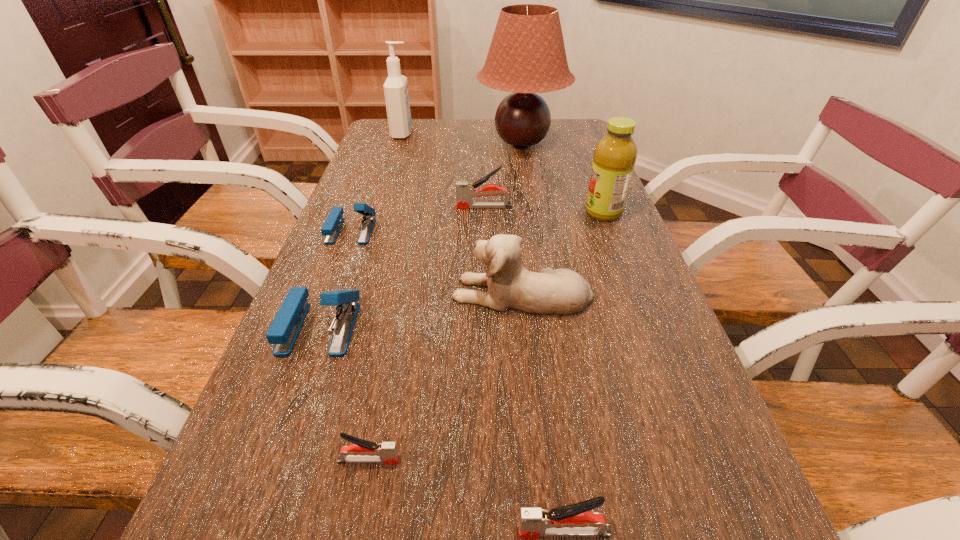
Locate an element on the screen. the fourth nearest stapler is located at coordinates (334, 221).

Identify the location of the farther blue stapler. This screenshot has width=960, height=540. (334, 221).

The width and height of the screenshot is (960, 540). In order to click on the smallest gray stapler in this screenshot , I will do `click(362, 451)`.

This screenshot has height=540, width=960. I want to click on the third stapler from right to left, so click(362, 451).

Locate an element on the screen. The height and width of the screenshot is (540, 960). vacant area situated on the front-facing side of the brown lampshade is located at coordinates (535, 224).

Where is `free spot located 0.360m on the front label of the cleansing agent`? The image size is (960, 540). free spot located 0.360m on the front label of the cleansing agent is located at coordinates (515, 133).

Where is `free space located 0.230m on the front label of the fruit juice`? The height and width of the screenshot is (540, 960). free space located 0.230m on the front label of the fruit juice is located at coordinates (x=498, y=213).

Identify the location of free region located 0.230m on the front label of the fruit juice. (498, 213).

Identify the location of vacant region located 0.070m on the front label of the fruit juice. This screenshot has width=960, height=540. (558, 213).

The image size is (960, 540). Find the location of `free region located on the front-facing side of the sixth shortest object`. free region located on the front-facing side of the sixth shortest object is located at coordinates (348, 293).